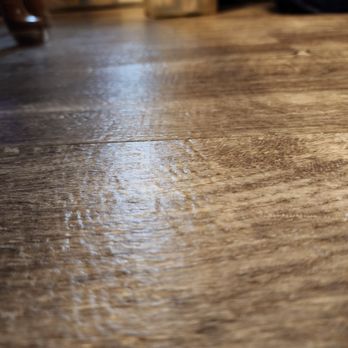
What are the coordinates of `reflection of light on foot of furniture` in the screenshot? It's located at (29, 18).